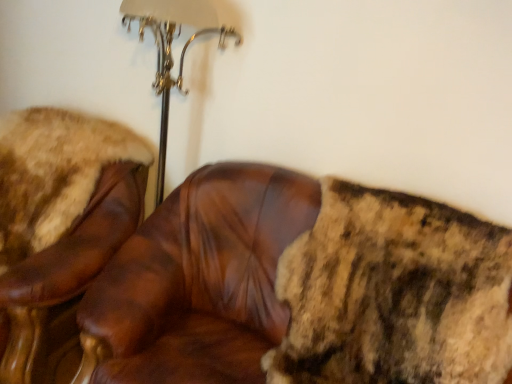
Question: In which direction should I rotate to look at brown leather chair at center, which ranks as the 2th chair in left-to-right order?

Choices:
 (A) right
 (B) left

Answer: (A)

Question: Can you see brown leather chair at center, acting as the first chair starting from the right, touching brown leather chair at upper left, which is counted as the 1th chair, starting from the left?

Choices:
 (A) no
 (B) yes

Answer: (A)

Question: From a real-world perspective, is brown leather chair at center, which ranks as the 2th chair in left-to-right order, under brown leather chair at upper left, which is counted as the 1th chair, starting from the left?

Choices:
 (A) yes
 (B) no

Answer: (B)

Question: Is brown leather chair at center, acting as the first chair starting from the right, bigger than brown leather chair at upper left, the 2th chair in the right-to-left sequence?

Choices:
 (A) yes
 (B) no

Answer: (A)

Question: Considering the relative positions of brown leather chair at center, acting as the first chair starting from the right, and brown leather chair at upper left, which is counted as the 1th chair, starting from the left, in the image provided, is brown leather chair at center, acting as the first chair starting from the right, in front of brown leather chair at upper left, which is counted as the 1th chair, starting from the left,?

Choices:
 (A) yes
 (B) no

Answer: (A)

Question: Considering the relative sizes of brown leather chair at center, acting as the first chair starting from the right, and brown leather chair at upper left, which is counted as the 1th chair, starting from the left, in the image provided, is brown leather chair at center, acting as the first chair starting from the right, shorter than brown leather chair at upper left, which is counted as the 1th chair, starting from the left,?

Choices:
 (A) no
 (B) yes

Answer: (A)

Question: Could you tell me if brown leather chair at center, acting as the first chair starting from the right, is turned towards brown leather chair at upper left, which is counted as the 1th chair, starting from the left?

Choices:
 (A) no
 (B) yes

Answer: (A)

Question: Considering the relative sizes of brown leather chair at upper left, the 2th chair in the right-to-left sequence, and brown leather chair at center, which ranks as the 2th chair in left-to-right order, in the image provided, is brown leather chair at upper left, the 2th chair in the right-to-left sequence, shorter than brown leather chair at center, which ranks as the 2th chair in left-to-right order,?

Choices:
 (A) yes
 (B) no

Answer: (A)

Question: Is brown leather chair at upper left, the 2th chair in the right-to-left sequence, at the left side of brown leather chair at center, acting as the first chair starting from the right?

Choices:
 (A) yes
 (B) no

Answer: (A)

Question: Are brown leather chair at upper left, the 2th chair in the right-to-left sequence, and brown leather chair at center, acting as the first chair starting from the right, making contact?

Choices:
 (A) no
 (B) yes

Answer: (A)

Question: Could you tell me if brown leather chair at upper left, which is counted as the 1th chair, starting from the left, is turned towards brown leather chair at center, acting as the first chair starting from the right?

Choices:
 (A) no
 (B) yes

Answer: (A)

Question: From the image's perspective, is brown leather chair at upper left, the 2th chair in the right-to-left sequence, on top of brown leather chair at center, acting as the first chair starting from the right?

Choices:
 (A) yes
 (B) no

Answer: (A)

Question: From a real-world perspective, is brown leather chair at upper left, which is counted as the 1th chair, starting from the left, on top of brown leather chair at center, which ranks as the 2th chair in left-to-right order?

Choices:
 (A) yes
 (B) no

Answer: (B)

Question: Is brown leather chair at center, which ranks as the 2th chair in left-to-right order, inside the boundaries of brown leather chair at upper left, the 2th chair in the right-to-left sequence, or outside?

Choices:
 (A) inside
 (B) outside

Answer: (B)